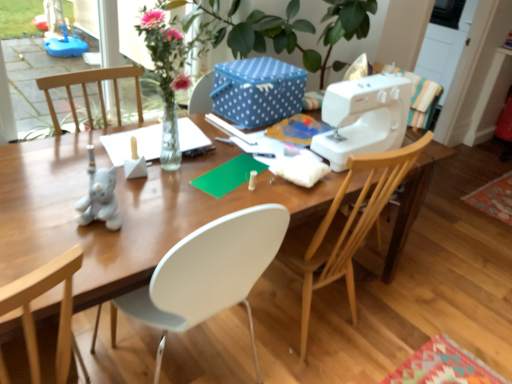
What is the approximate width of white plastic sewing machine at right?

white plastic sewing machine at right is 6.68 inches in width.

The height and width of the screenshot is (384, 512). Describe the element at coordinates (362, 117) in the screenshot. I see `white plastic sewing machine at right` at that location.

This screenshot has width=512, height=384. I want to click on white plastic sewing machine at right, so click(x=362, y=117).

Could you tell me if white plastic sewing machine at right is facing blue dotted fabric box at upper center?

No, white plastic sewing machine at right is not aimed at blue dotted fabric box at upper center.

Is blue dotted fabric box at upper center located within white plastic sewing machine at right?

Definitely not — blue dotted fabric box at upper center is not inside white plastic sewing machine at right.

Is white plastic sewing machine at right not close to blue dotted fabric box at upper center?

No, white plastic sewing machine at right is not far away from blue dotted fabric box at upper center.

From the image's perspective, is wooden desk at center positioned above or below white plastic sewing machine at right?

wooden desk at center is below white plastic sewing machine at right.

Identify the location of desk below the white plastic sewing machine at right (from the image's perspective). The height and width of the screenshot is (384, 512). (121, 212).

Considering the relative sizes of wooden desk at center and white plastic sewing machine at right in the image provided, is wooden desk at center bigger than white plastic sewing machine at right?

Correct, wooden desk at center is larger in size than white plastic sewing machine at right.

Can you tell me how much white plastic sewing machine at right and wooden chair at right differ in facing direction?

They differ by 178 degrees in their facing directions.

Is white plastic sewing machine at right positioned beyond the bounds of wooden chair at right?

Actually, white plastic sewing machine at right is at least partially inside wooden chair at right.

Between white plastic sewing machine at right and wooden chair at right, which one is positioned behind?

white plastic sewing machine at right.

From a real-world perspective, between white plastic sewing machine at right and wooden chair at right, who is vertically higher?

white plastic sewing machine at right, from a real-world perspective.

From the picture: Is wooden desk at center wider or thinner than wooden chair at right?

wooden desk at center is wider than wooden chair at right.

Is point (391, 240) more distant than point (428, 141)?

That is True.

Would you say wooden desk at center contains wooden chair at right?

Yes, wooden chair at right can be found within wooden desk at center.

Is wooden desk at center positioned with its back to wooden chair at right?

Yes, wooden desk at center's orientation is away from wooden chair at right.

From a real-world perspective, which is physically below, wooden chair at right or wooden desk at center?

wooden desk at center.

Is wooden chair at right far from wooden desk at center?

Actually, wooden chair at right and wooden desk at center are a little close together.

Which of these two, wooden chair at right or wooden desk at center, is bigger?

wooden desk at center.

Is wooden chair at right aimed at wooden desk at center?

Yes.

Measure the distance from wooden chair at right to white plastic sewing machine at right.

wooden chair at right is 24.23 centimeters away from white plastic sewing machine at right.

Considering the positions of objects wooden chair at right and white plastic sewing machine at right in the image provided, who is in front, wooden chair at right or white plastic sewing machine at right?

Positioned in front is wooden chair at right.

Is wooden chair at right facing towards white plastic sewing machine at right?

No, wooden chair at right is not facing towards white plastic sewing machine at right.

From a real-world perspective, is wooden chair at right below white plastic sewing machine at right?

Yes, from a real-world perspective, wooden chair at right is under white plastic sewing machine at right.

Which object is positioned more to the right, wooden chair at right or blue dotted fabric box at upper center?

wooden chair at right.

Considering the sizes of wooden chair at right and blue dotted fabric box at upper center in the image, is wooden chair at right wider or thinner than blue dotted fabric box at upper center?

wooden chair at right is wider than blue dotted fabric box at upper center.

Which is in front, point (347, 222) or point (278, 83)?

The point (347, 222) is more forward.

Does wooden chair at right turn towards blue dotted fabric box at upper center?

Yes, wooden chair at right is turned towards blue dotted fabric box at upper center.

Where is `box located above the white plastic sewing machine at right (from the image's perspective)`? This screenshot has width=512, height=384. box located above the white plastic sewing machine at right (from the image's perspective) is located at coordinates (257, 91).

Locate an element on the screen. Image resolution: width=512 pixels, height=384 pixels. desk that appears on the left of white plastic sewing machine at right is located at coordinates (121, 212).

Which object lies further to the anchor point wooden desk at center, blue dotted fabric box at upper center or wooden chair at right?

blue dotted fabric box at upper center.

Which object lies nearer to the anchor point wooden desk at center, wooden chair at right or white plastic sewing machine at right?

wooden chair at right is positioned closer to the anchor wooden desk at center.

Based on their spatial positions, is white plastic sewing machine at right or wooden chair at right further from wooden desk at center?

Based on the image, white plastic sewing machine at right appears to be further to wooden desk at center.

Considering their positions, is white plastic sewing machine at right positioned closer to wooden chair at right than wooden desk at center?

Among the two, white plastic sewing machine at right is located nearer to wooden chair at right.

Estimate the real-world distances between objects in this image. Which object is further from white plastic sewing machine at right, wooden desk at center or wooden chair at right?

wooden desk at center lies further to white plastic sewing machine at right than the other object.

Looking at the image, which one is located further to white plastic sewing machine at right, wooden chair at right or blue dotted fabric box at upper center?

Among the two, blue dotted fabric box at upper center is located further to white plastic sewing machine at right.

When comparing their distances from white plastic sewing machine at right, does wooden desk at center or blue dotted fabric box at upper center seem further?

Based on the image, wooden desk at center appears to be further to white plastic sewing machine at right.

Considering their positions, is blue dotted fabric box at upper center positioned closer to wooden chair at right than white plastic sewing machine at right?

white plastic sewing machine at right is positioned closer to the anchor wooden chair at right.

Where is `chair positioned between wooden desk at center and blue dotted fabric box at upper center from near to far`? The image size is (512, 384). chair positioned between wooden desk at center and blue dotted fabric box at upper center from near to far is located at coordinates (345, 227).

Identify the location of sewing machine located between wooden desk at center and blue dotted fabric box at upper center in the depth direction. The image size is (512, 384). click(362, 117).

Locate an element on the screen. This screenshot has width=512, height=384. chair between wooden desk at center and white plastic sewing machine at right from front to back is located at coordinates (345, 227).

I want to click on sewing machine between blue dotted fabric box at upper center and wooden chair at right in the up-down direction, so click(362, 117).